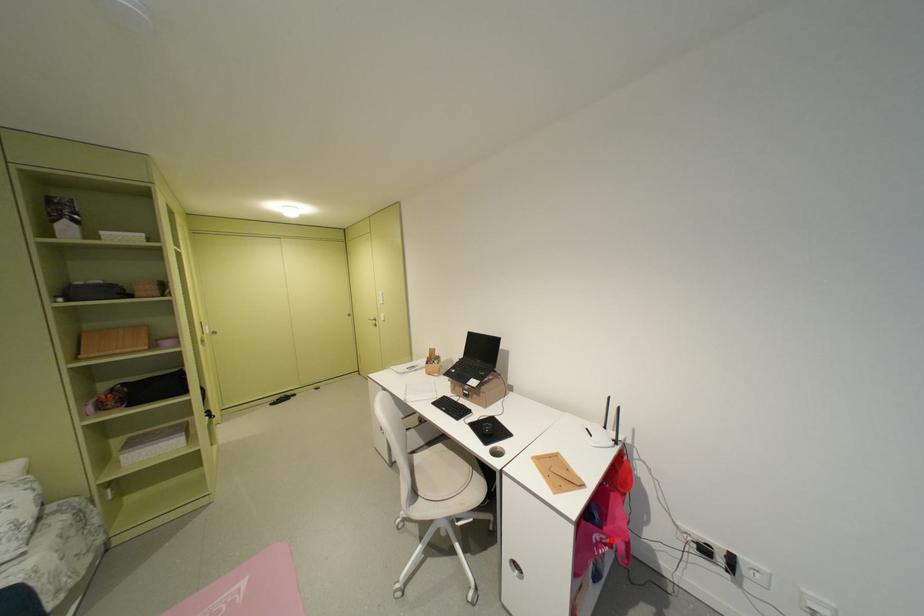
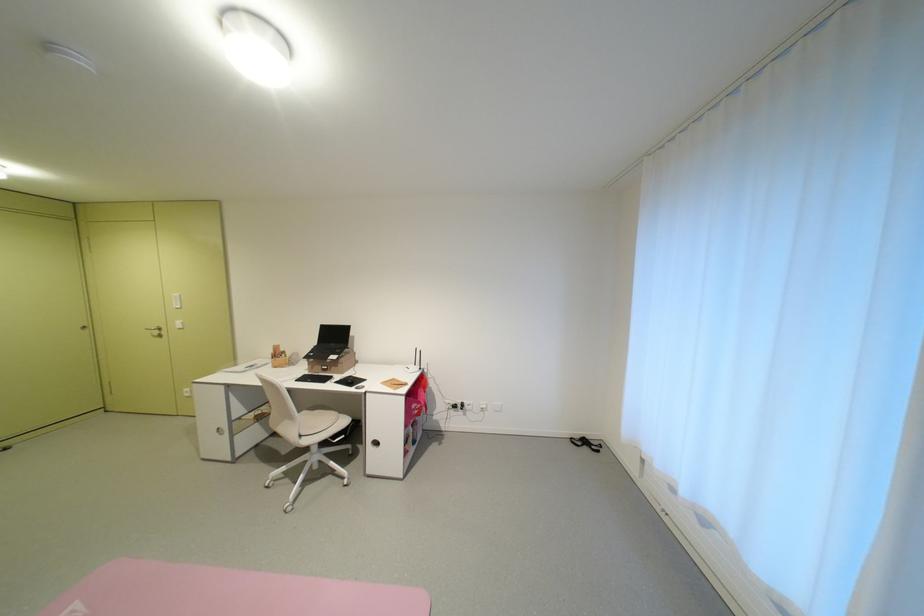
Question: I am providing you with two images of the same scene from different viewpoints. Given a red point in image1, look at the same physical point in image2. Is it:

Choices:
 (A) Closer to the viewpoint
 (B) Farther from the viewpoint

Answer: (A)